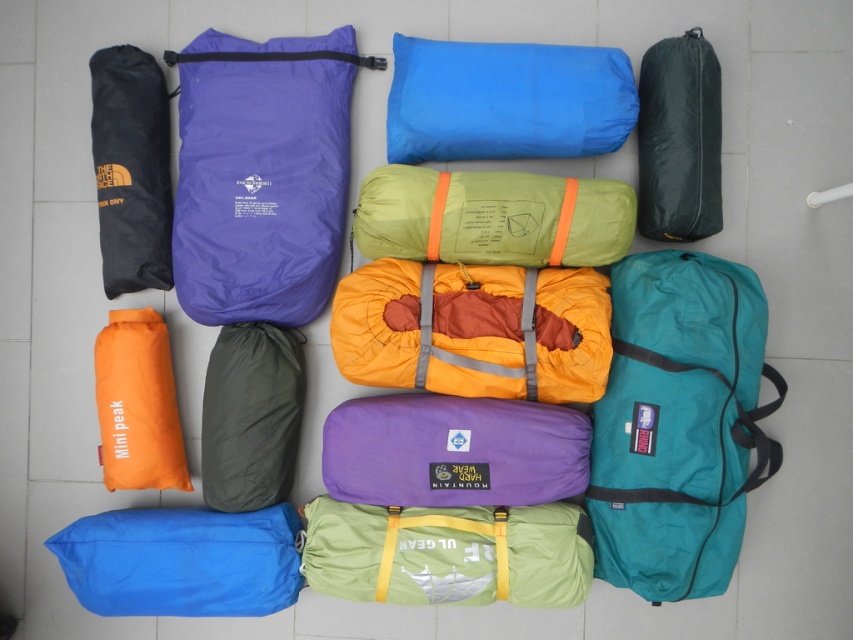
Which is more to the right, blue fabric sleeping bag at center or black nylon bag at upper left?

From the viewer's perspective, blue fabric sleeping bag at center appears more on the right side.

Is blue fabric sleeping bag at center positioned behind black nylon bag at upper left?

No, it is not.

Locate an element on the screen. This screenshot has height=640, width=853. blue fabric sleeping bag at center is located at coordinates (183, 561).

Does teal fabric duffel at center right have a smaller size compared to blue fabric sleeping bag at center?

No, teal fabric duffel at center right is not smaller than blue fabric sleeping bag at center.

Who is positioned more to the left, teal fabric duffel at center right or blue fabric sleeping bag at center?

From the viewer's perspective, blue fabric sleeping bag at center appears more on the left side.

Measure the distance between point (643, 512) and camera.

Point (643, 512) is 4.90 feet from camera.

Find the location of a particular element. teal fabric duffel at center right is located at coordinates (677, 422).

Who is more distant from viewer, (206, 600) or (161, 477)?

Point (161, 477)

The height and width of the screenshot is (640, 853). I want to click on blue fabric sleeping bag at center, so click(x=183, y=561).